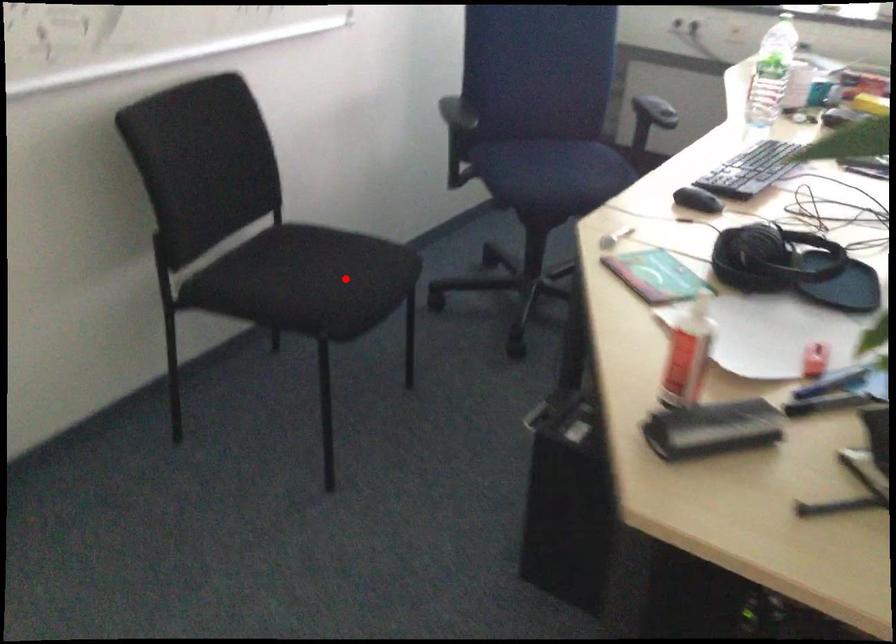
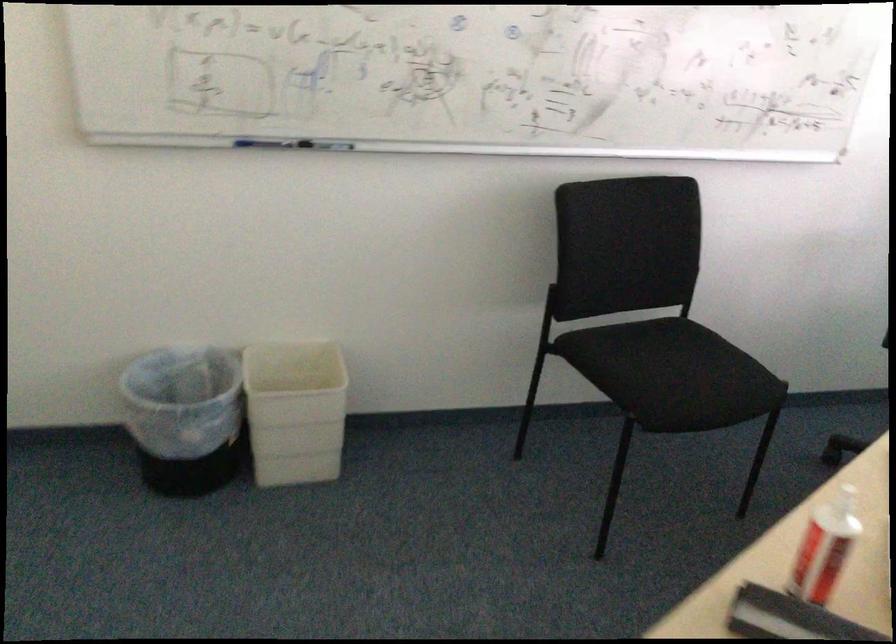
Find the pixel in the second image that matches the highlighted location in the first image.

(688, 379)